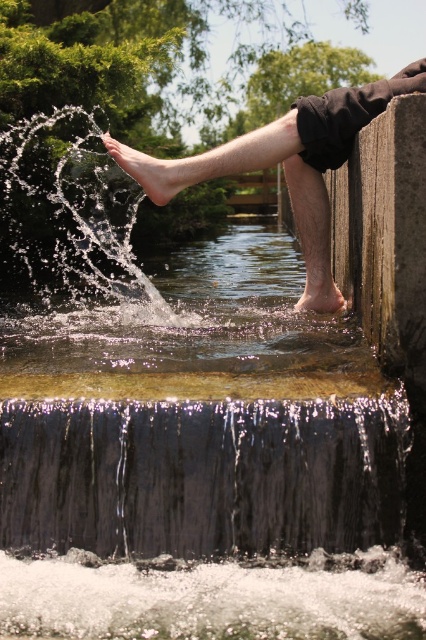
You are a photographer trying to capture the reflection of the shiny metallic waterfall at lower center and the barefoot skin at upper center in the water. Which object will have a larger reflection in the water?

The barefoot skin at upper center will have a larger reflection in the water because it occupies more space than the shiny metallic waterfall at lower center.

You are standing at the origin point of the image. There is a clear water at left at point (x=68, y=212). Where is the clear water at left located?

The clear water at left is located at point (x=68, y=212).